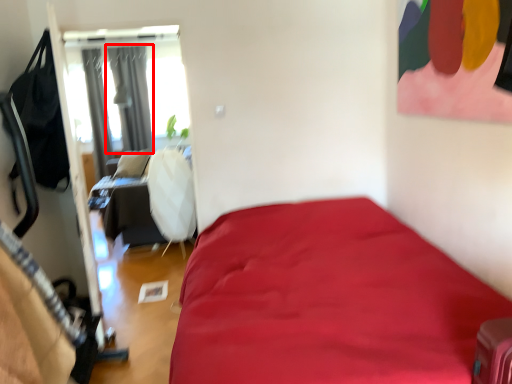
Question: Considering the relative positions of curtain (annotated by the red box) and curtain in the image provided, where is curtain (annotated by the red box) located with respect to the staircase?

Choices:
 (A) right
 (B) left

Answer: (A)